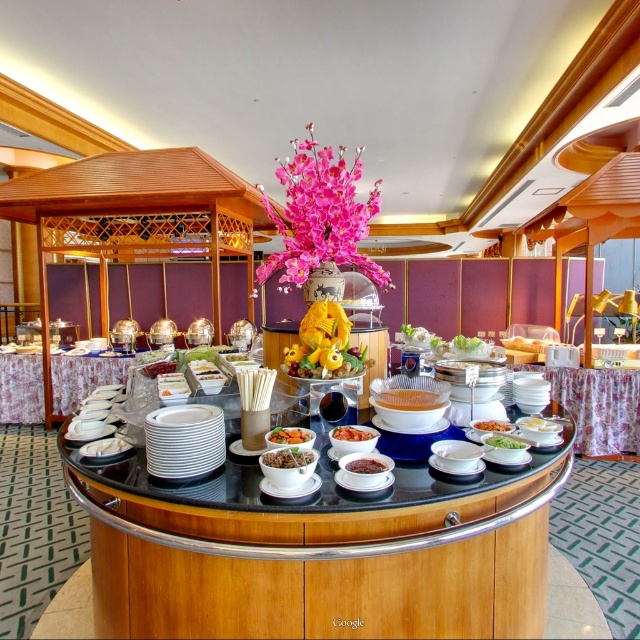
Question: Is wooden buffet at center thinner than yellow matte fruit at center?

Choices:
 (A) yes
 (B) no

Answer: (B)

Question: Among these objects, which one is nearest to the camera?

Choices:
 (A) translucent plastic container at center
 (B) floral fabric tablecloth at right
 (C) wooden buffet at center
 (D) matte white bowl at center

Answer: (C)

Question: Can you confirm if wooden buffet at center is positioned below smooth white rice at center?

Choices:
 (A) yes
 (B) no

Answer: (A)

Question: Which point is closer to the camera?

Choices:
 (A) yellow matte fruit at center
 (B) white glossy bowl at center

Answer: (B)

Question: Does white glossy bowl at center come in front of matte white bowl at center?

Choices:
 (A) yes
 (B) no

Answer: (A)

Question: Considering the real-world distances, which object is closest to the white glossy bowl at center?

Choices:
 (A) matte white bowl at center
 (B) smooth white rice at center

Answer: (B)